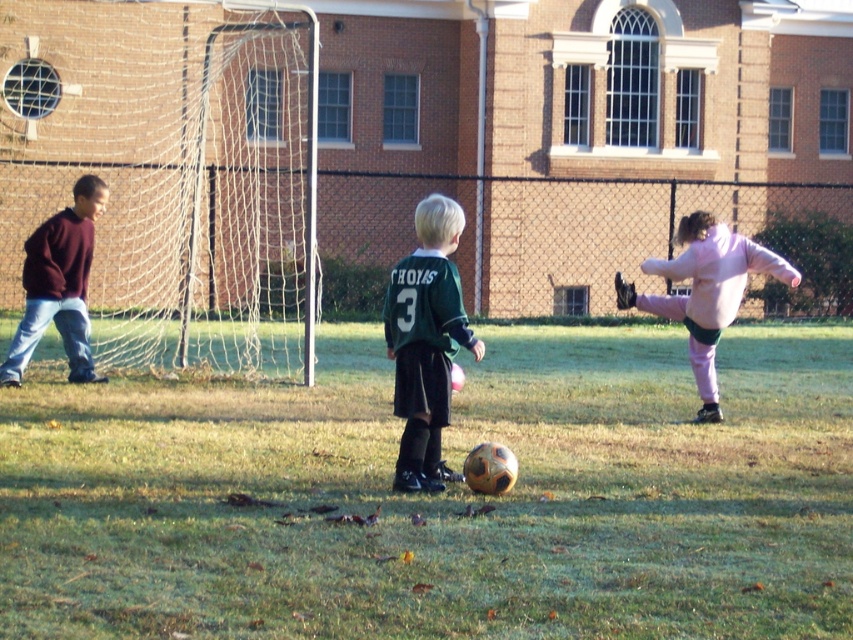
Question: Is orange textured ball at center above maroon sweater at left?

Choices:
 (A) yes
 (B) no

Answer: (B)

Question: Where is orange textured ball at center located in relation to maroon sweater at left in the image?

Choices:
 (A) right
 (B) left

Answer: (A)

Question: Which object appears farthest from the camera in this image?

Choices:
 (A) orange textured ball at center
 (B) maroon sweater at left
 (C) green matte jersey at center

Answer: (B)

Question: Observing the image, what is the correct spatial positioning of orange textured ball at center in reference to pink fleece jacket at right?

Choices:
 (A) above
 (B) below

Answer: (B)

Question: Considering the real-world distances, which object is farthest from the orange textured ball at center?

Choices:
 (A) green matte jersey at center
 (B) maroon sweater at left
 (C) pink fleece jacket at right

Answer: (B)

Question: Based on their relative distances, which object is farther from the pink fleece jacket at right?

Choices:
 (A) green matte jersey at center
 (B) maroon sweater at left
 (C) orange textured ball at center

Answer: (B)